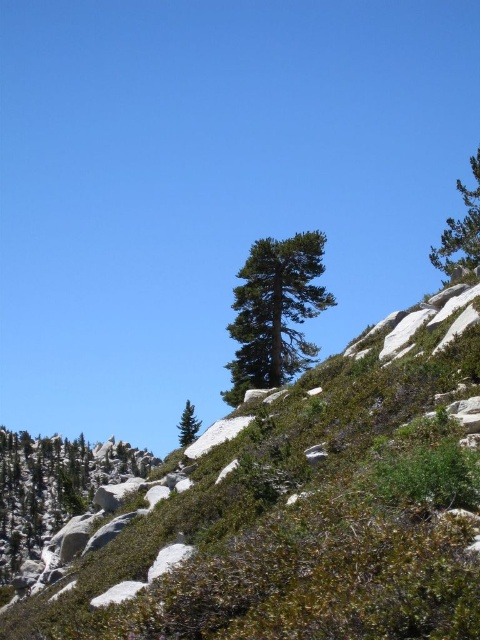
Can you confirm if green textured pine at center is positioned below green textured pine at upper right?

Yes.

Between green textured pine at center and green textured pine at upper right, which one appears on the left side from the viewer's perspective?

green textured pine at center is more to the left.

Does point (229, 401) lie in front of point (468, 236)?

No.

Locate an element on the screen. Image resolution: width=480 pixels, height=640 pixels. green textured pine at center is located at coordinates (275, 310).

Who is taller, green textured pine at center or green matte tree at center?

green matte tree at center is taller.

Who is more forward, (272,337) or (196,422)?

Positioned in front is point (272,337).

Locate an element on the screen. This screenshot has width=480, height=640. green textured pine at center is located at coordinates (275, 310).

Who is positioned more to the right, green textured pine at upper right or green matte tree at center?

green textured pine at upper right is more to the right.

Between point (476, 220) and point (180, 432), which one is positioned in front?

Point (476, 220) is in front.

Is point (469, 234) more distant than point (193, 419)?

No, it is in front of (193, 419).

At what (x,y) coordinates should I click in order to perform the action: click on green textured pine at upper right. Please return your answer as a coordinate pair (x, y). Looking at the image, I should click on (460, 230).